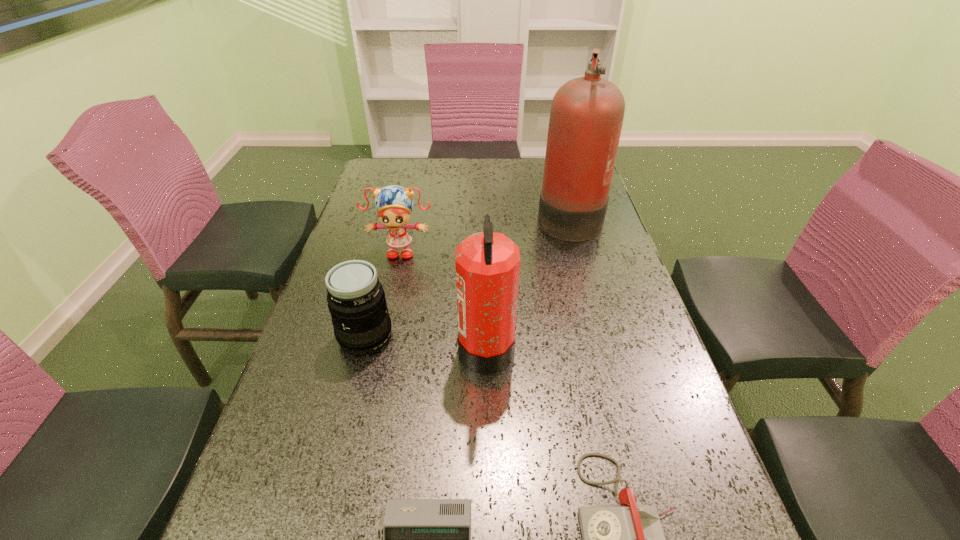
Identify which object is the fourth nearest to the right fire extinguisher. Please provide its 2D coordinates. Your answer should be formatted as a tuple, i.e. [(x, y)], where the tuple contains the x and y coordinates of a point satisfying the conditions above.

[(626, 539)]